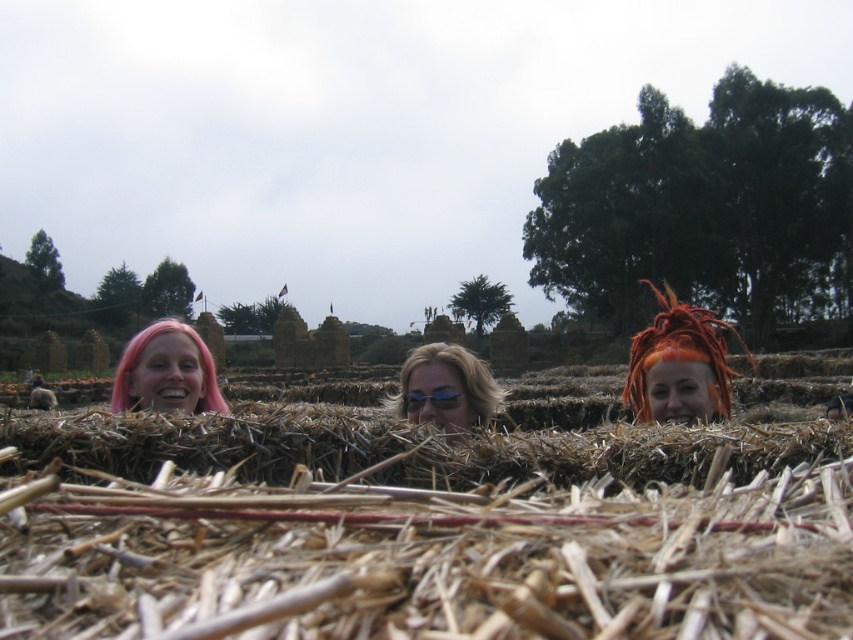
Question: Can you confirm if pastel pink hair at left is wider than sunglasses at center?

Choices:
 (A) no
 (B) yes

Answer: (B)

Question: Which point is closer to the camera?

Choices:
 (A) (136, 385)
 (B) (424, 397)
 (C) (439, 404)

Answer: (C)

Question: In this image, where is orange dreadlocks at center located relative to sunglasses at center?

Choices:
 (A) left
 (B) right

Answer: (B)

Question: Which of the following is the farthest from the observer?

Choices:
 (A) (711, 355)
 (B) (434, 392)

Answer: (A)

Question: Can you confirm if orange dreadlocks at center is smaller than shiny blue sunglasses at center?

Choices:
 (A) yes
 (B) no

Answer: (B)

Question: Which of the following is the closest to the observer?

Choices:
 (A) pastel pink hair at left
 (B) shiny blue sunglasses at center
 (C) orange dreadlocks at center

Answer: (B)